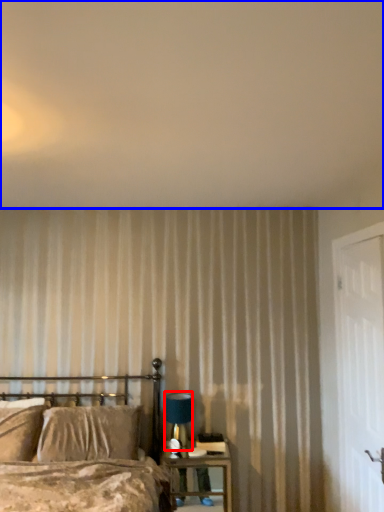
Question: Which point is further to the camera, table lamp (highlighted by a red box) or backdrop (highlighted by a blue box)?

Choices:
 (A) table lamp
 (B) backdrop

Answer: (A)